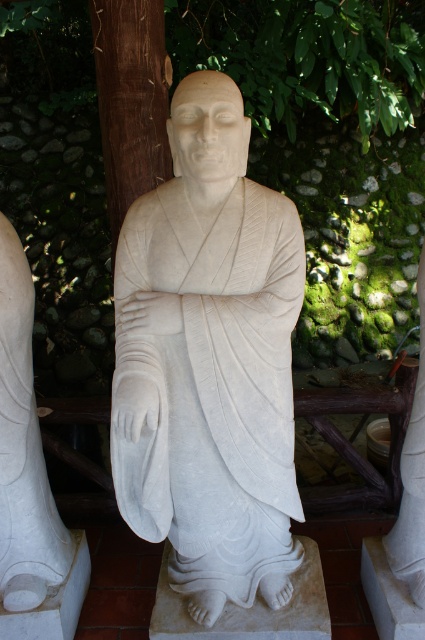
You are an art conservator assessing the space between two statues in the garden. The statues are the white marble statue at center and the white marble statue at lower left. If you need to place a protective barrier between them, which statue has a wider base to consider for proper placement?

The white marble statue at center has a wider base than the white marble statue at lower left, so the barrier should be placed closer to the narrower statue to ensure stability.

You are a visitor at a garden and see the white marble statue at center and the white marble statue at lower left. Which one is placed higher up?

The white marble statue at center is positioned over the white marble statue at lower left, so it is placed higher up.